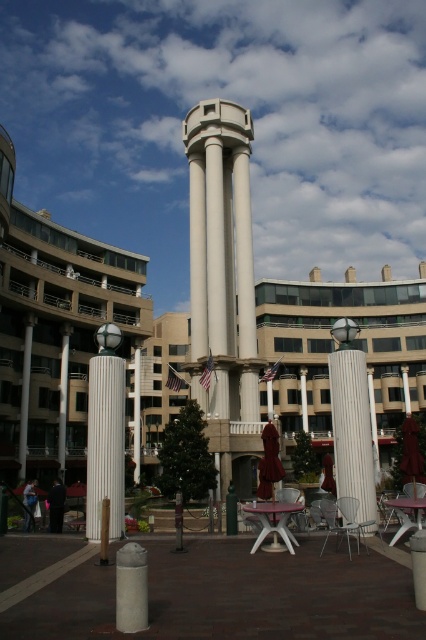
You are planning to set up a small sculpture exhibition in the plaza. You have a sculpture that is the same size as the metallic silver chair at lower right. Can the sculpture be placed next to the white concrete tower at center without looking out of place in terms of scale?

The white concrete tower at center is bigger than the metallic silver chair at lower right. Since the sculpture is the same size as the metallic silver chair at lower right, it would not look out of place next to the tower as the tower is larger and serves as a dominant feature in the plaza.

In the scene shown: You are planning to seat a group of four people at the plaza. You have a white plastic chair at lower right and a blue fabric monk at lower left available. Considering their sizes, which one can accommodate more people?

The blue fabric monk at lower left is larger than the white plastic chair at lower right, so it can accommodate more people.